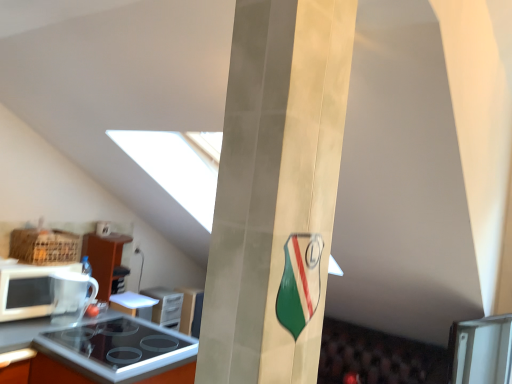
Question: From a real-world perspective, relative to white glossy microwave at left, is black glass stove at lower left, which is the 1th appliance from back to front, vertically above or below?

Choices:
 (A) above
 (B) below

Answer: (B)

Question: Is black glass stove at lower left, which is counted as the third appliance, starting from the front, wider or thinner than white glossy microwave at left?

Choices:
 (A) thin
 (B) wide

Answer: (A)

Question: Estimate the real-world distances between objects in this image. Which object is farther from the matte gold pillar at center?

Choices:
 (A) white glossy microwave at left
 (B) black glass stove at lower left, which is counted as the third appliance, starting from the front
 (C) orange laminate countertop at lower left
 (D) white glossy plate at lower center, arranged as the second appliance when viewed from the back
 (E) transparent glass mug at lower left, placed as the 1th appliance when sorted from front to back

Answer: (B)

Question: Which object is the farthest from the white glossy microwave at left?

Choices:
 (A) black glass stove at lower left, which is the 1th appliance from back to front
 (B) transparent glass mug at lower left, acting as the third appliance starting from the back
 (C) matte gold pillar at center
 (D) white glossy plate at lower center, arranged as the second appliance when viewed from the front
 (E) orange laminate countertop at lower left

Answer: (C)